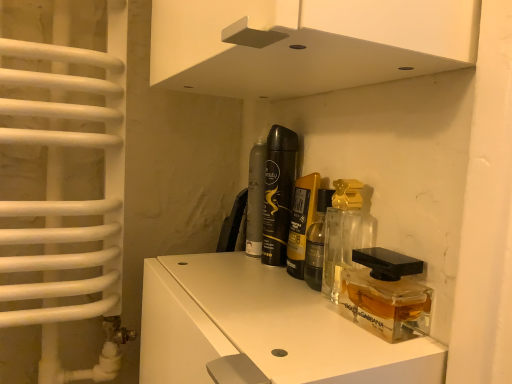
The width and height of the screenshot is (512, 384). I want to click on free point above transparent glass perfume bottles at center (from a real-world perspective), so pyautogui.click(x=248, y=287).